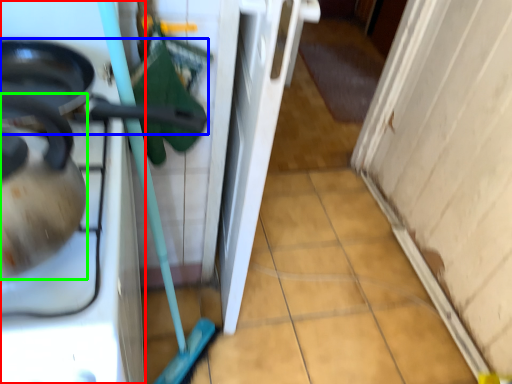
Question: Which object is positioned closest to home appliance (highlighted by a red box)? Select from frying pan (highlighted by a blue box) and tea pot (highlighted by a green box).

Choices:
 (A) frying pan
 (B) tea pot

Answer: (A)